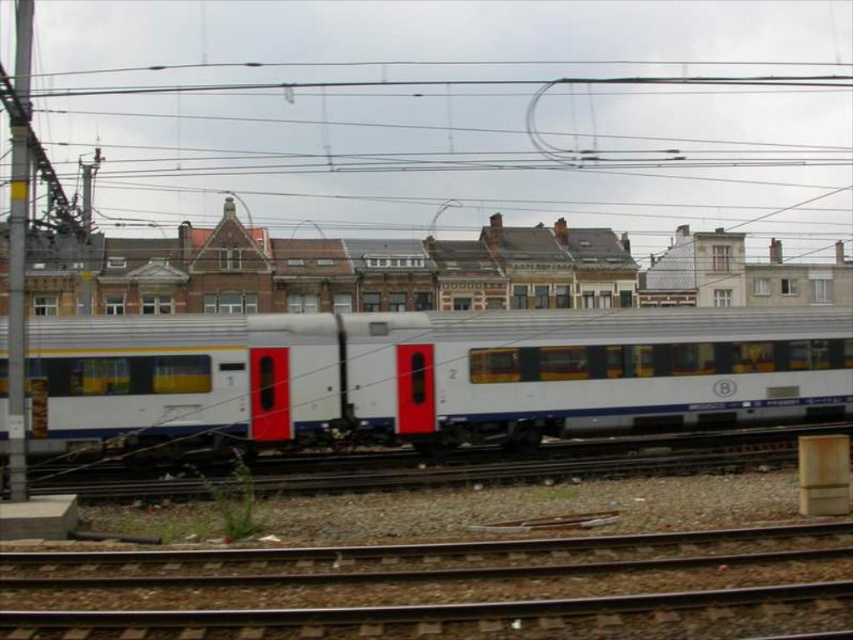
From the picture: Can you confirm if white glossy train car at center is positioned to the left of brown gravel train track at lower center?

Incorrect, white glossy train car at center is not on the left side of brown gravel train track at lower center.

Which is more to the right, white glossy train car at center or brown gravel train track at lower center?

From the viewer's perspective, white glossy train car at center appears more on the right side.

Is point (631, 378) closer to camera compared to point (703, 609)?

No, it is not.

Locate an element on the screen. The image size is (853, 640). white glossy train car at center is located at coordinates (427, 376).